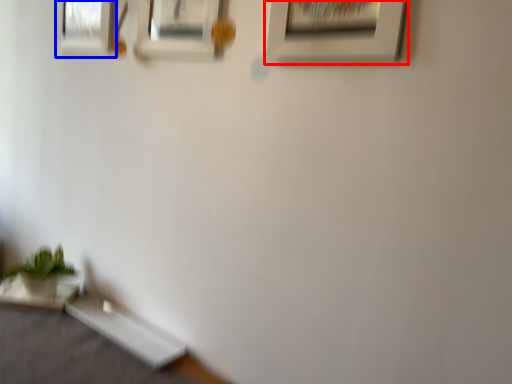
Question: Which object appears closest to the camera in this image, picture frame (highlighted by a red box) or picture frame (highlighted by a blue box)?

Choices:
 (A) picture frame
 (B) picture frame

Answer: (A)